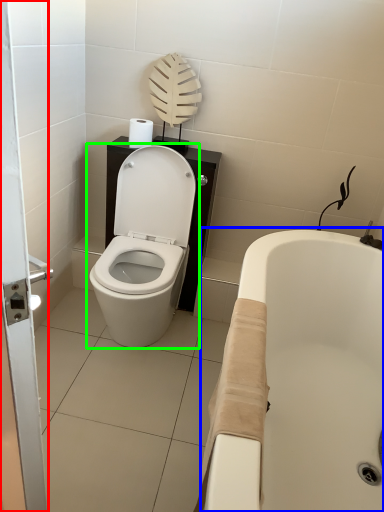
Question: Estimate the real-world distances between objects in this image. Which object is farther from screen door (highlighted by a red box), bath (highlighted by a blue box) or toilet (highlighted by a green box)?

Choices:
 (A) bath
 (B) toilet

Answer: (B)